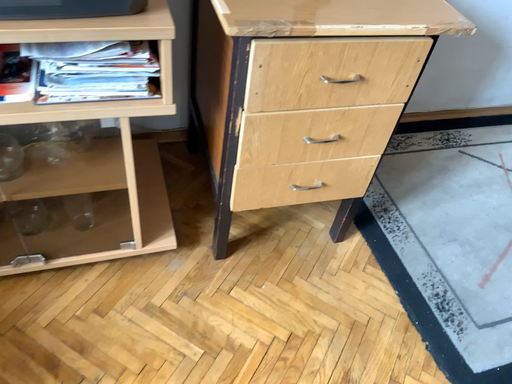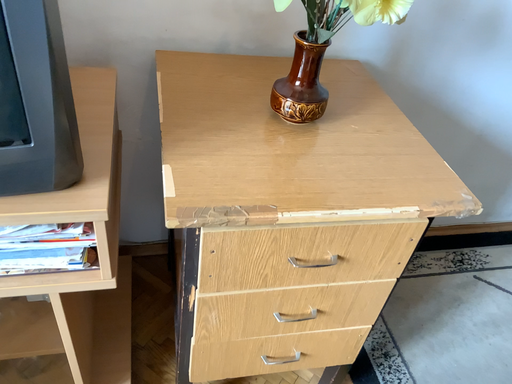
Question: How did the camera likely rotate when shooting the video?

Choices:
 (A) rotated upward
 (B) rotated downward

Answer: (A)